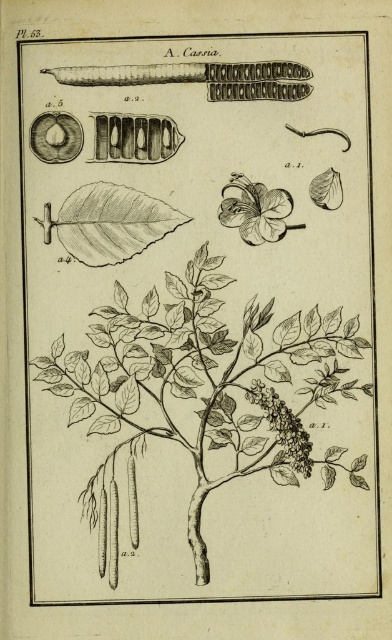
Is black ink tree at center smaller than white paper-like petals at center?

No, black ink tree at center is not smaller than white paper-like petals at center.

Does black ink tree at center appear on the left side of white paper-like petals at center?

Yes, black ink tree at center is to the left of white paper-like petals at center.

This screenshot has width=392, height=640. What do you see at coordinates (203, 394) in the screenshot?
I see `black ink tree at center` at bounding box center [203, 394].

You are a GUI agent. You are given a task and a screenshot of the screen. Output one action in this format:
    pyautogui.click(x=<x>, y=<y>)
    Task: Click on the black ink tree at center
    Image resolution: width=392 pixels, height=640 pixels.
    Given the screenshot: What is the action you would take?
    pyautogui.click(x=203, y=394)